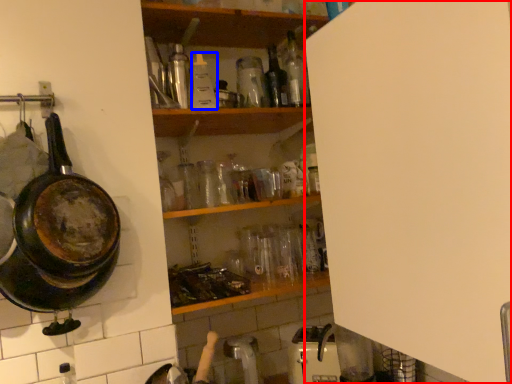
Question: Which point is further to the camera, side (highlighted by a red box) or bottle (highlighted by a blue box)?

Choices:
 (A) side
 (B) bottle

Answer: (B)